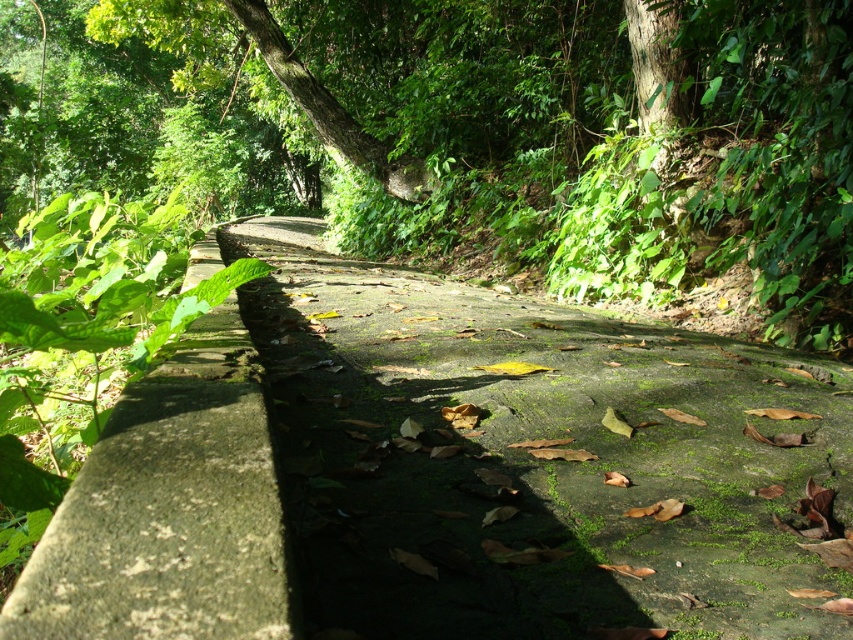
You are standing at the point marked as point (531, 460) in the image. What is the name of the object you are currently standing on?

You are standing on the green mossy concrete trail at center, which is located at point (531, 460).

You are a hiker who wants to step from the green mossy stone at left onto the green mossy concrete trail at center. Considering their heights, will you need to climb up or step down?

The green mossy concrete trail at center is much taller than the green mossy stone at left, so you will need to climb up to step onto it.